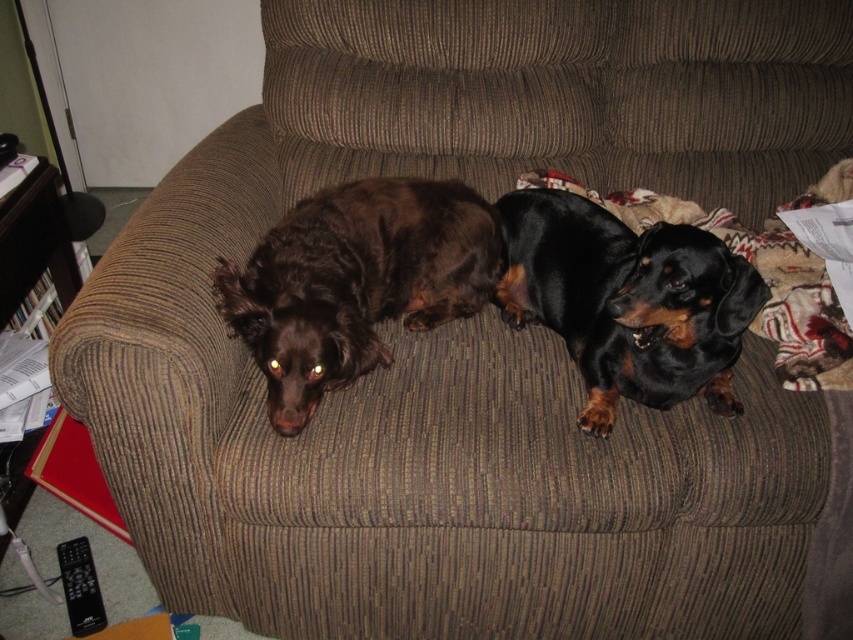
Who is positioned more to the right, shiny brown dog at center or black shiny dog at center?

black shiny dog at center is more to the right.

Between point (230, 269) and point (726, 262), which one is positioned in front?

Point (726, 262)

Find the location of a particular element. The width and height of the screenshot is (853, 640). shiny brown dog at center is located at coordinates (355, 282).